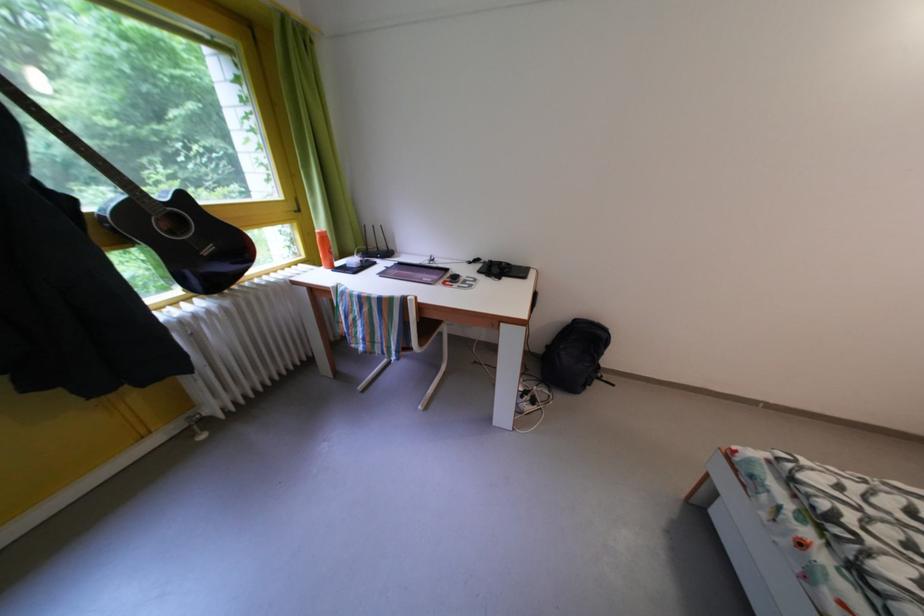
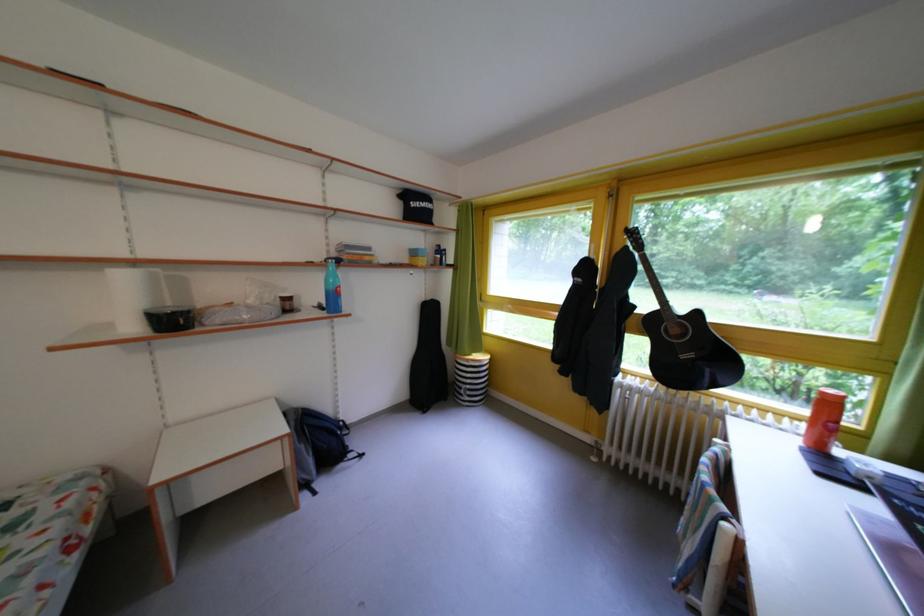
Based on the continuous images, in which direction is the camera rotating?

The rotation direction of the camera is left-down.